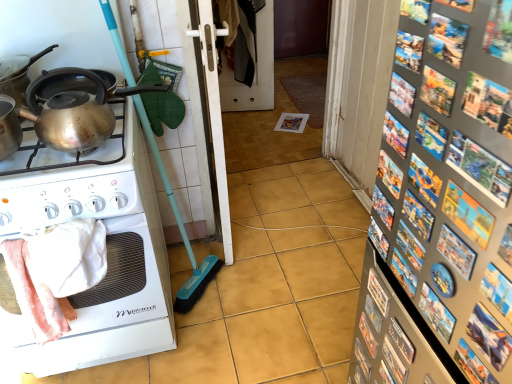
Locate an element on the screen. The width and height of the screenshot is (512, 384). empty space that is to the right of white plastic screen door at center, positioned as the second screen door in back-to-front order is located at coordinates [295, 217].